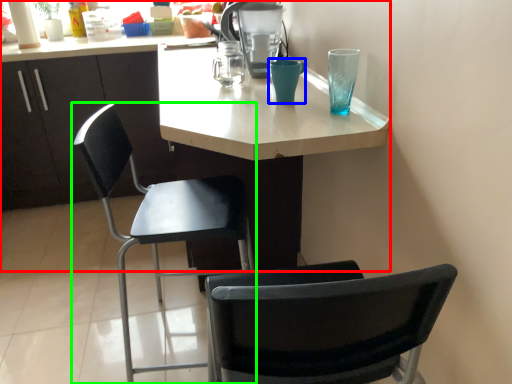
Question: Estimate the real-world distances between objects in this image. Which object is farther from desk (highlighted by a red box), teal (highlighted by a blue box) or chair (highlighted by a green box)?

Choices:
 (A) teal
 (B) chair

Answer: (A)